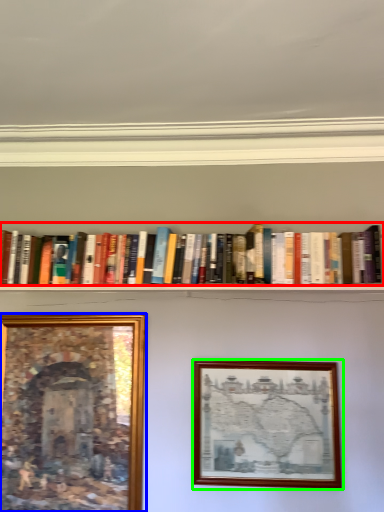
Question: Based on their relative distances, which object is nearer to book (highlighted by a red box)? Choose from picture frame (highlighted by a blue box) and picture frame (highlighted by a green box).

Choices:
 (A) picture frame
 (B) picture frame

Answer: (B)